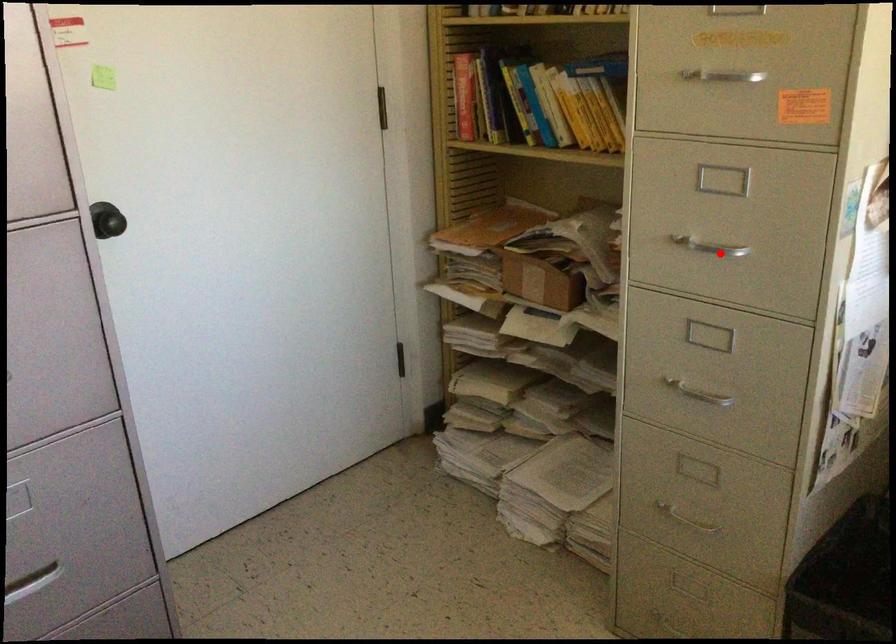
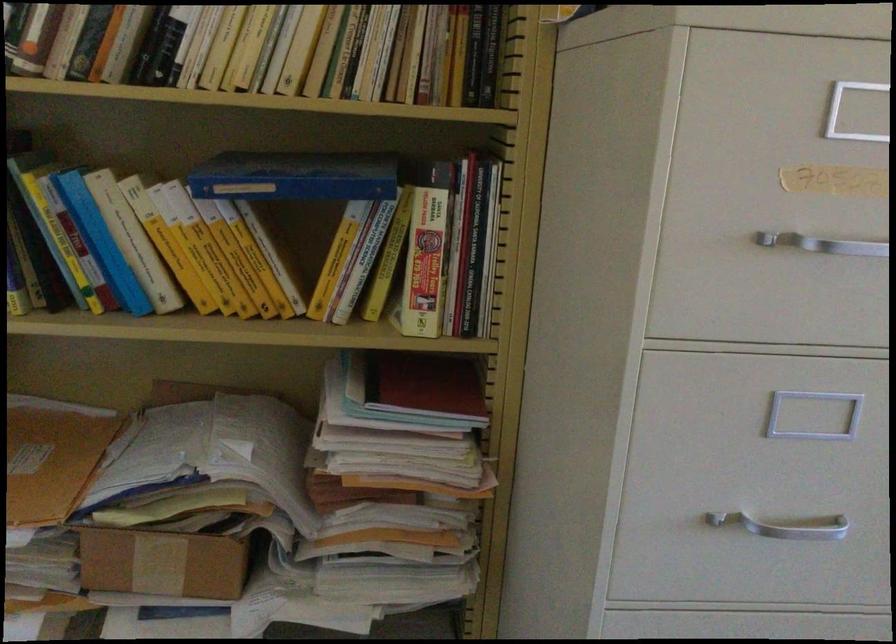
Find the pixel in the second image that matches the highlighted location in the first image.

(784, 526)